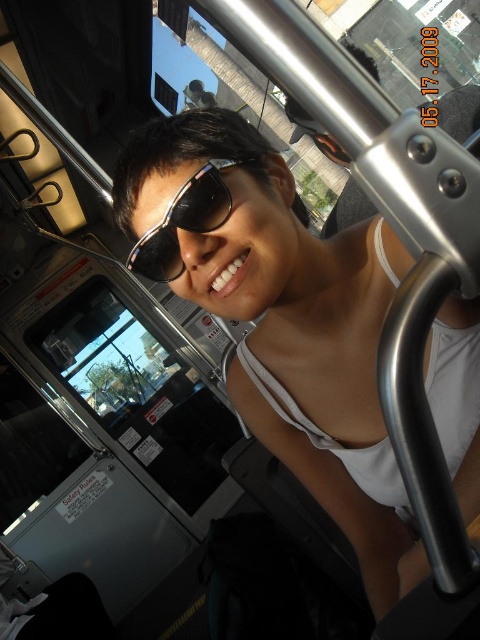
Question: Does white matte tank top at center appear under sunglasses at center?

Choices:
 (A) yes
 (B) no

Answer: (A)

Question: Observing the image, what is the correct spatial positioning of white matte tank top at center in reference to sunglasses at center?

Choices:
 (A) left
 (B) right

Answer: (B)

Question: From the image, what is the correct spatial relationship of white matte tank top at center in relation to sunglasses at center?

Choices:
 (A) left
 (B) right

Answer: (B)

Question: Among these points, which one is farthest from the camera?

Choices:
 (A) (195, 195)
 (B) (204, 289)

Answer: (B)